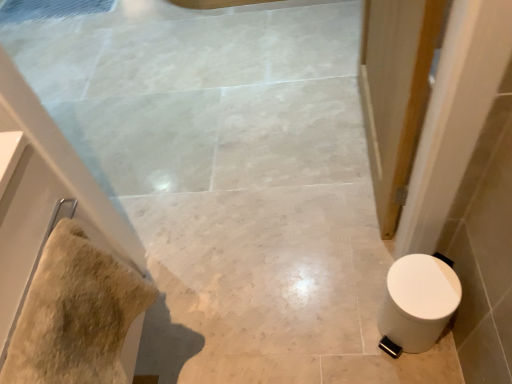
Question: Would you say beige fluffy towel at left is to the left or to the right of white glossy toilet at lower right in the picture?

Choices:
 (A) left
 (B) right

Answer: (A)

Question: Considering their positions, is beige fluffy towel at left located in front of or behind white glossy toilet at lower right?

Choices:
 (A) behind
 (B) front

Answer: (B)

Question: Is beige fluffy towel at left bigger or smaller than white glossy toilet at lower right?

Choices:
 (A) small
 (B) big

Answer: (A)

Question: Is white glossy toilet at lower right inside the boundaries of beige fluffy towel at left, or outside?

Choices:
 (A) inside
 (B) outside

Answer: (B)

Question: Is white glossy toilet at lower right taller or shorter than beige fluffy towel at left?

Choices:
 (A) tall
 (B) short

Answer: (A)

Question: From a real-world perspective, is white glossy toilet at lower right above or below beige fluffy towel at left?

Choices:
 (A) above
 (B) below

Answer: (B)

Question: In terms of width, does white glossy toilet at lower right look wider or thinner when compared to beige fluffy towel at left?

Choices:
 (A) wide
 (B) thin

Answer: (A)